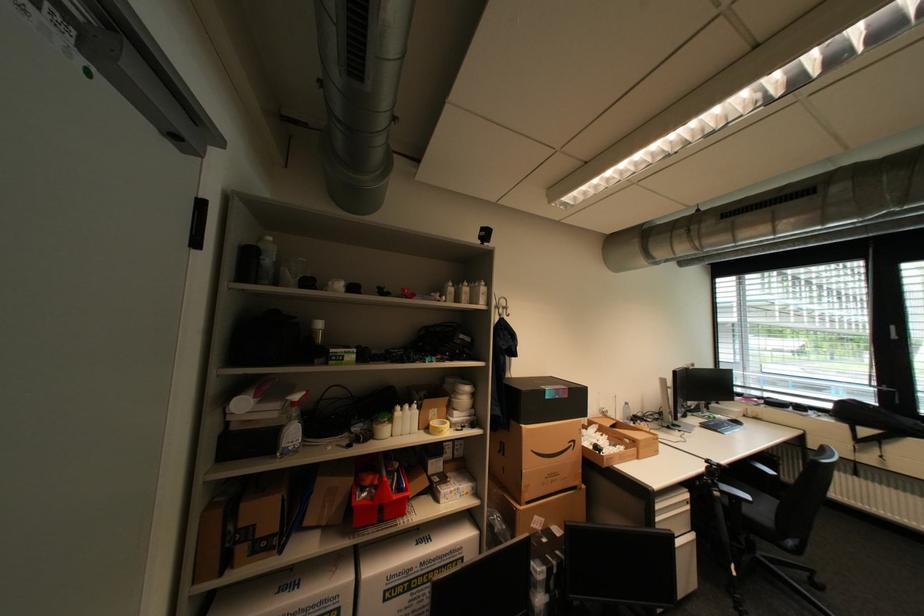
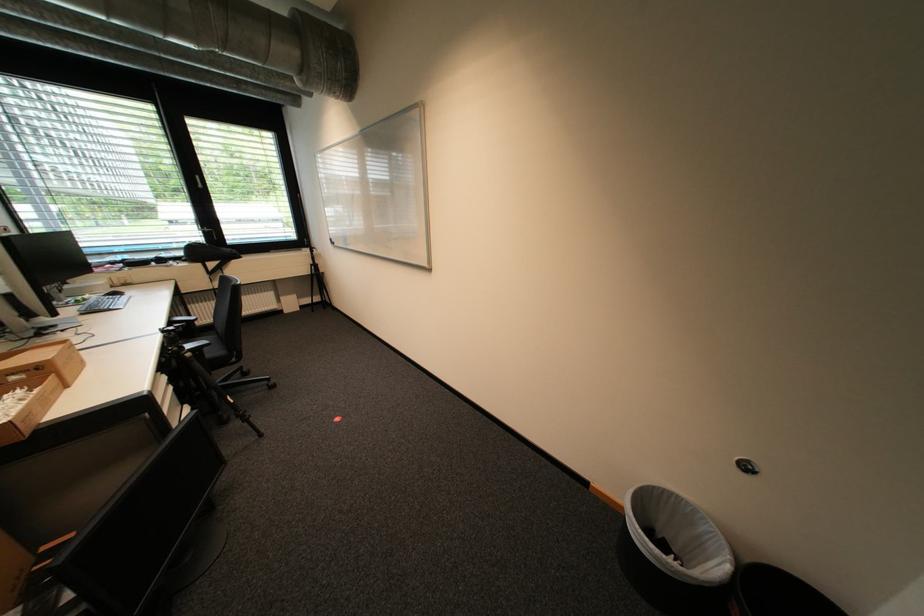
The point at (719,482) is marked in the first image. Where is the corresponding point in the second image?

(185, 349)